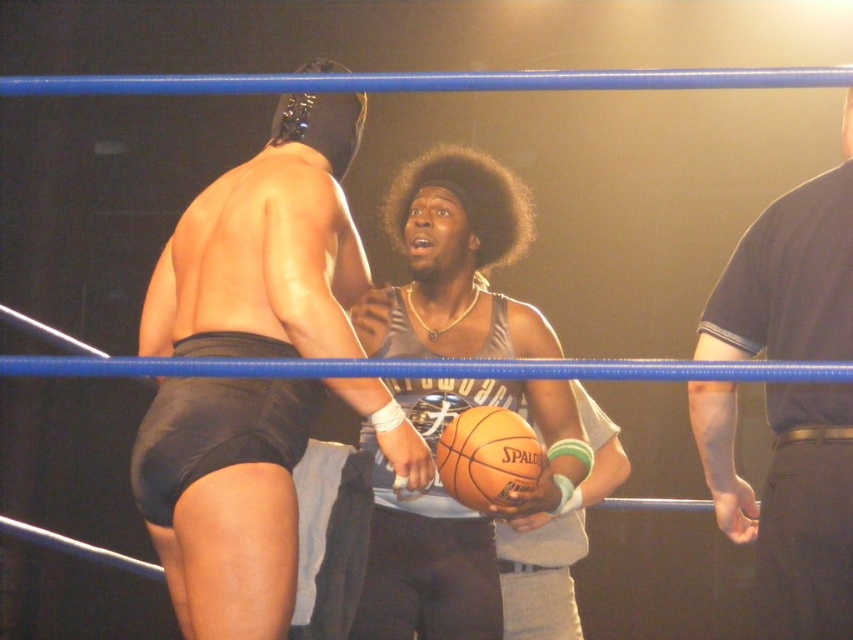
You are standing in the wrestling ring and want to throw a ball to the point at coordinates point (292,353). If your arm can reach up to 2 meters, will you be able to reach that point?

The point (292,353) is 1.94 meters away from you, so yes, you can reach it since your arm can reach up to 2 meters.